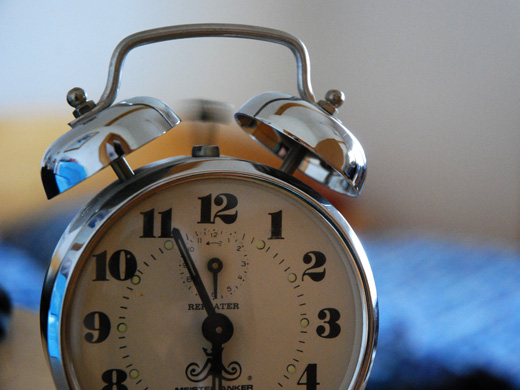
You are a GUI agent. You are given a task and a screenshot of the screen. Output one action in this format:
    pyautogui.click(x=<x>, y=<y>)
    Task: Click on the shadow on clock face
    
    Given the screenshot: What is the action you would take?
    tap(241, 315)